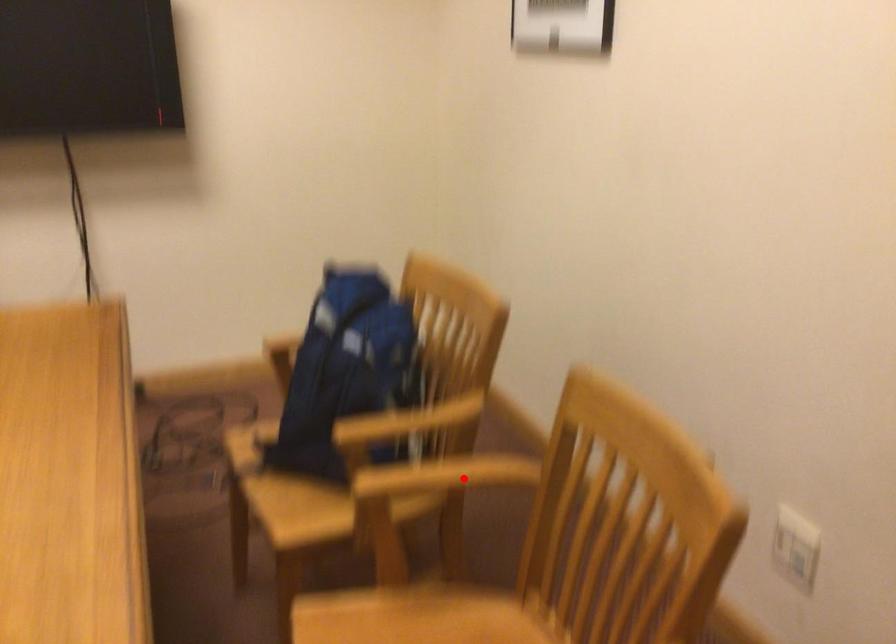
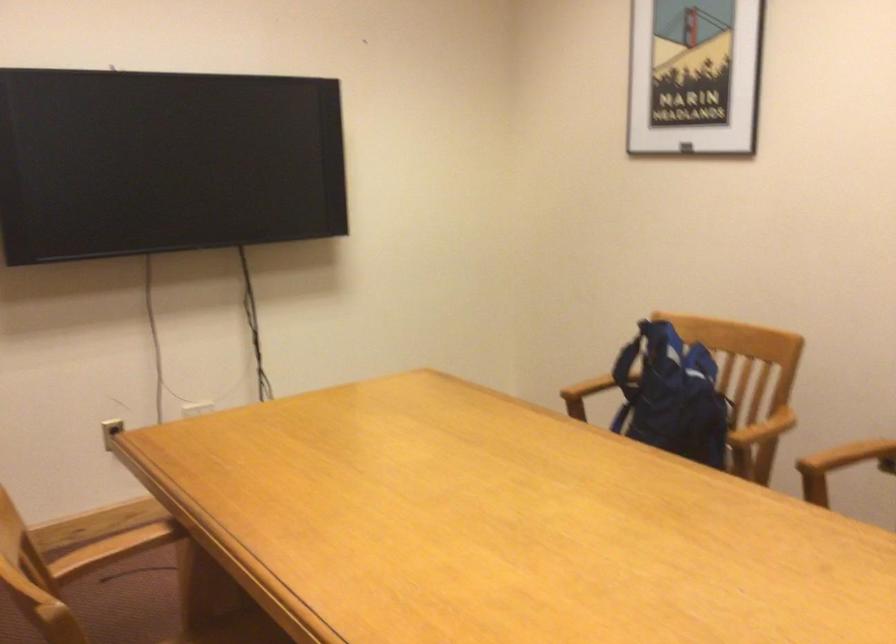
Question: I am providing you with two images of the same scene from different viewpoints. Image1 has a red point marked. In image2, the corresponding 3D location appears at what relative position? Reply with the corresponding letter.

Choices:
 (A) Closer
 (B) Farther

Answer: (B)